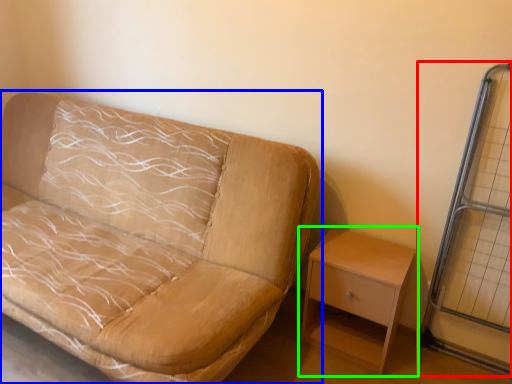
Question: Which object is positioned farthest from glass door (highlighted by a red box)? Select from studio couch (highlighted by a blue box) and nightstand (highlighted by a green box).

Choices:
 (A) studio couch
 (B) nightstand

Answer: (A)